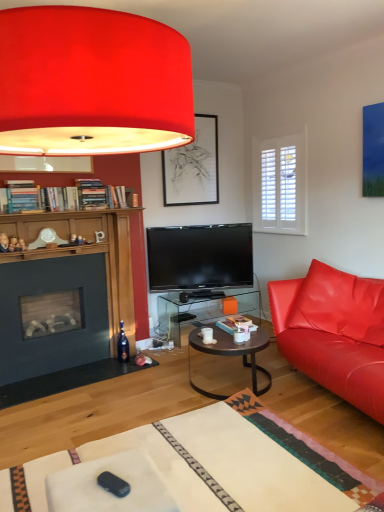
Question: Does black plastic remote control at lower center have a greater width compared to matte red lampshade at upper center?

Choices:
 (A) yes
 (B) no

Answer: (B)

Question: Is black plastic remote control at lower center positioned in front of matte red lampshade at upper center?

Choices:
 (A) no
 (B) yes

Answer: (A)

Question: Is black plastic remote control at lower center shorter than matte red lampshade at upper center?

Choices:
 (A) no
 (B) yes

Answer: (B)

Question: Is black plastic remote control at lower center far away from matte red lampshade at upper center?

Choices:
 (A) no
 (B) yes

Answer: (B)

Question: Can you confirm if black plastic remote control at lower center is smaller than matte red lampshade at upper center?

Choices:
 (A) no
 (B) yes

Answer: (B)

Question: Is black plastic remote control at lower center next to matte red lampshade at upper center and touching it?

Choices:
 (A) yes
 (B) no

Answer: (B)

Question: Considering the relative sizes of matte leather couch at right and matte black picture frame at upper center in the image provided, is matte leather couch at right taller than matte black picture frame at upper center?

Choices:
 (A) no
 (B) yes

Answer: (A)

Question: Is matte leather couch at right in front of matte black picture frame at upper center?

Choices:
 (A) no
 (B) yes

Answer: (B)

Question: Does matte leather couch at right lie behind matte black picture frame at upper center?

Choices:
 (A) no
 (B) yes

Answer: (A)

Question: From a real-world perspective, is matte leather couch at right below matte black picture frame at upper center?

Choices:
 (A) no
 (B) yes

Answer: (B)

Question: Can you confirm if matte leather couch at right is shorter than matte black picture frame at upper center?

Choices:
 (A) no
 (B) yes

Answer: (B)

Question: Is matte leather couch at right oriented towards matte black picture frame at upper center?

Choices:
 (A) yes
 (B) no

Answer: (B)

Question: Could you tell me if white glossy coffee cup at center is facing matte leather couch at right?

Choices:
 (A) no
 (B) yes

Answer: (A)